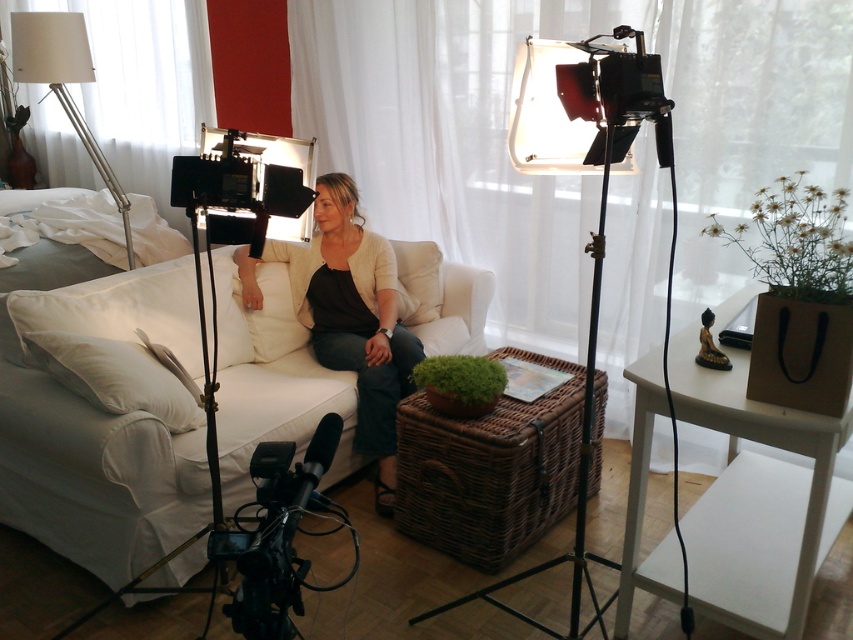
Looking at this image, can you confirm if metallic tripod at center is positioned above white fabric lampshade at upper left?

Incorrect, metallic tripod at center is not positioned above white fabric lampshade at upper left.

Which is behind, point (668, 147) or point (56, 24)?

Positioned behind is point (56, 24).

Is point (604, 634) positioned in front of point (49, 90)?

Yes, point (604, 634) is in front of point (49, 90).

I want to click on metallic tripod at center, so click(579, 451).

Is point (117, 330) more distant than point (55, 68)?

No, (117, 330) is in front of (55, 68).

Does white fabric couch at center have a larger size compared to white fabric lampshade at upper left?

Correct, white fabric couch at center is larger in size than white fabric lampshade at upper left.

Between point (112, 321) and point (70, 36), which one is positioned in front?

Point (112, 321)

Find the location of a particular element. The height and width of the screenshot is (640, 853). white fabric couch at center is located at coordinates (94, 474).

Is matte black sweater at center further to camera compared to white fabric lampshade at upper left?

No.

Can you confirm if matte black sweater at center is positioned to the right of white fabric lampshade at upper left?

Correct, you'll find matte black sweater at center to the right of white fabric lampshade at upper left.

Where is `matte black sweater at center`? The width and height of the screenshot is (853, 640). matte black sweater at center is located at coordinates (354, 317).